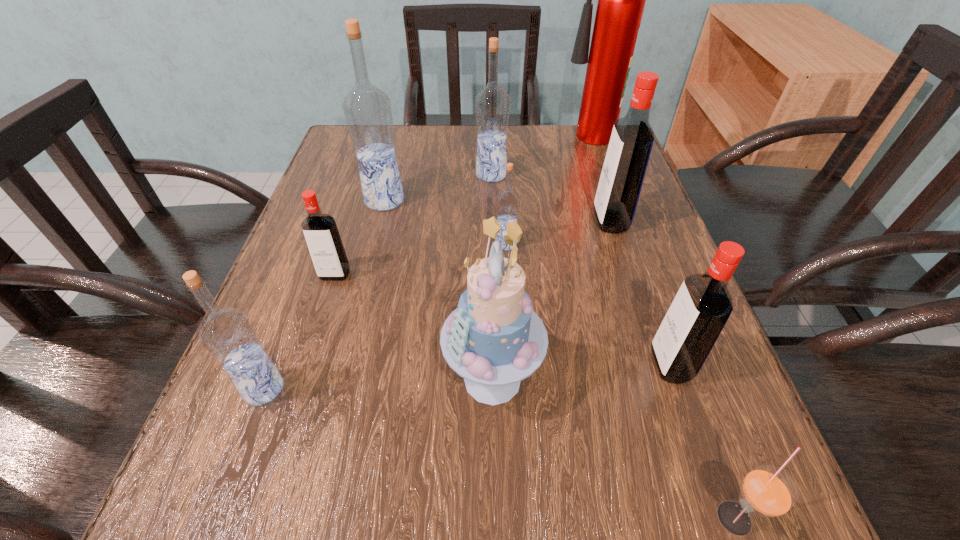
Identify which blue vodka is located as the fourth nearest to the nearest red vodka. Please provide its 2D coordinates. Your answer should be formatted as a tuple, i.e. [(x, y)], where the tuple contains the x and y coordinates of a point satisfying the conditions above.

[(227, 334)]

You are a GUI agent. You are given a task and a screenshot of the screen. Output one action in this format:
    pyautogui.click(x=<x>, y=<y>)
    Task: Click on the second closest red vodka to the leftmost blue vodka
    
    Given the screenshot: What is the action you would take?
    pyautogui.click(x=703, y=304)

Image resolution: width=960 pixels, height=540 pixels. Identify the location of red vodka object that ranks as the closest to the second farthest red vodka. (623, 172).

The width and height of the screenshot is (960, 540). I want to click on free spot that satisfies the following two spatial constraints: 1. at the nozzle of the red fire extinguisher; 2. on the front side of the fourth farthest vodka, so click(x=624, y=244).